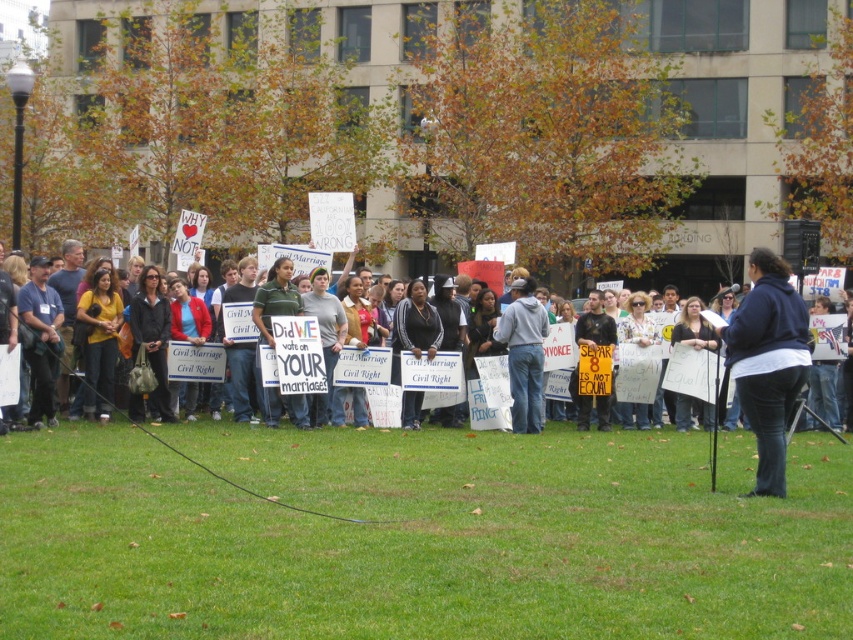
You are a photographer trying to capture a candid shot of the person speaking at the protest. You notice the dark blue hoodie at center and denim jeans at center. Which clothing item is taller in the image?

The dark blue hoodie at center is taller than the denim jeans at center.